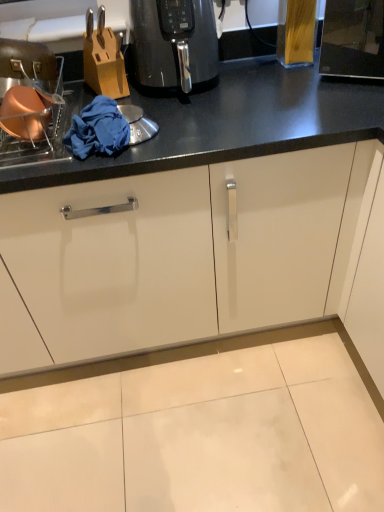
Question: Is the position of black glossy air fryer at center more distant than that of blue fabric at left?

Choices:
 (A) no
 (B) yes

Answer: (B)

Question: Can you confirm if black glossy air fryer at center is shorter than blue fabric at left?

Choices:
 (A) yes
 (B) no

Answer: (B)

Question: Is black glossy air fryer at center turned away from blue fabric at left?

Choices:
 (A) no
 (B) yes

Answer: (A)

Question: Is black glossy air fryer at center completely or partially outside of blue fabric at left?

Choices:
 (A) yes
 (B) no

Answer: (A)

Question: Is black glossy air fryer at center placed right next to blue fabric at left?

Choices:
 (A) no
 (B) yes

Answer: (A)

Question: From their relative heights in the image, would you say blue fabric at left is taller or shorter than black glossy air fryer at center?

Choices:
 (A) short
 (B) tall

Answer: (A)

Question: In the image, is blue fabric at left on the left side or the right side of black glossy air fryer at center?

Choices:
 (A) left
 (B) right

Answer: (A)

Question: Is blue fabric at left inside or outside of black glossy air fryer at center?

Choices:
 (A) outside
 (B) inside

Answer: (A)

Question: From the image's perspective, is blue fabric at left above or below black glossy air fryer at center?

Choices:
 (A) below
 (B) above

Answer: (A)

Question: From a real-world perspective, is matte copper pot at left positioned above or below blue fabric at left?

Choices:
 (A) below
 (B) above

Answer: (B)

Question: Is matte copper pot at left taller or shorter than blue fabric at left?

Choices:
 (A) tall
 (B) short

Answer: (A)

Question: From the image's perspective, is matte copper pot at left positioned above or below blue fabric at left?

Choices:
 (A) below
 (B) above

Answer: (B)

Question: Does point (34, 83) appear closer or farther from the camera than point (112, 136)?

Choices:
 (A) farther
 (B) closer

Answer: (A)

Question: From a real-world perspective, is matte copper pot at left physically located above or below black glossy air fryer at center?

Choices:
 (A) above
 (B) below

Answer: (B)

Question: Looking at the image, does matte copper pot at left seem bigger or smaller compared to black glossy air fryer at center?

Choices:
 (A) big
 (B) small

Answer: (A)